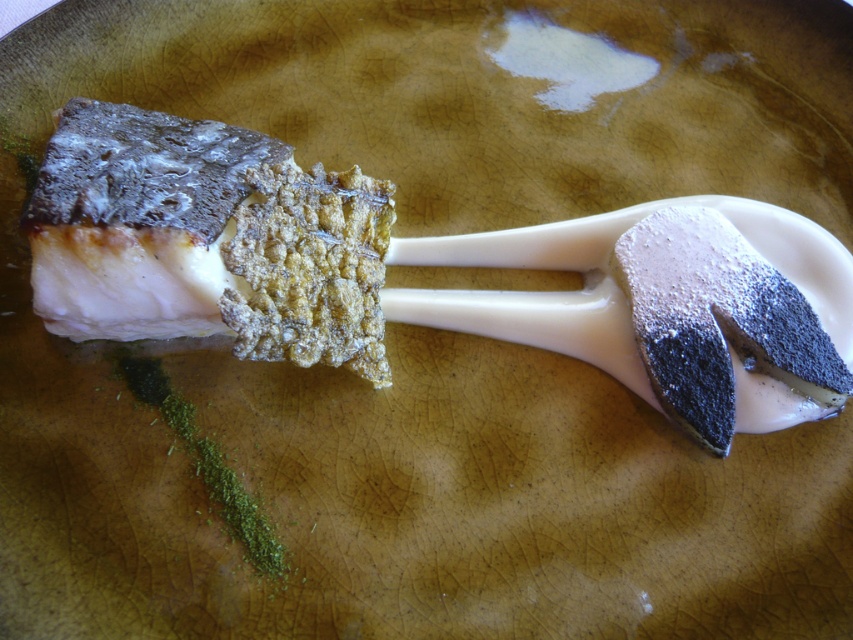
You are a food critic evaluating the presentation of a dish. You notice the white creamy fish at center and the smooth white cream at center on the plate. Which item is wider?

The white creamy fish at center is wider than the smooth white cream at center according to the description.

You are a food critic observing a plate with a white creamy fish at center and a smooth white cream at center. Which item is nearer to you?

The white creamy fish at center is closer to the viewer than the smooth white cream at center.

You are looking at the plate with the fish and spoon. There are two points marked on the plate. The first point is at coordinates point (282, 342) and the second is at point (688, 417). If you were to move from the first point to the second point, would you be moving towards the edge of the plate or away from it?

Moving from point (282, 342) to point (688, 417) would be moving away from the edge of the plate because point (282, 342) is closer to the edge than point (688, 417).